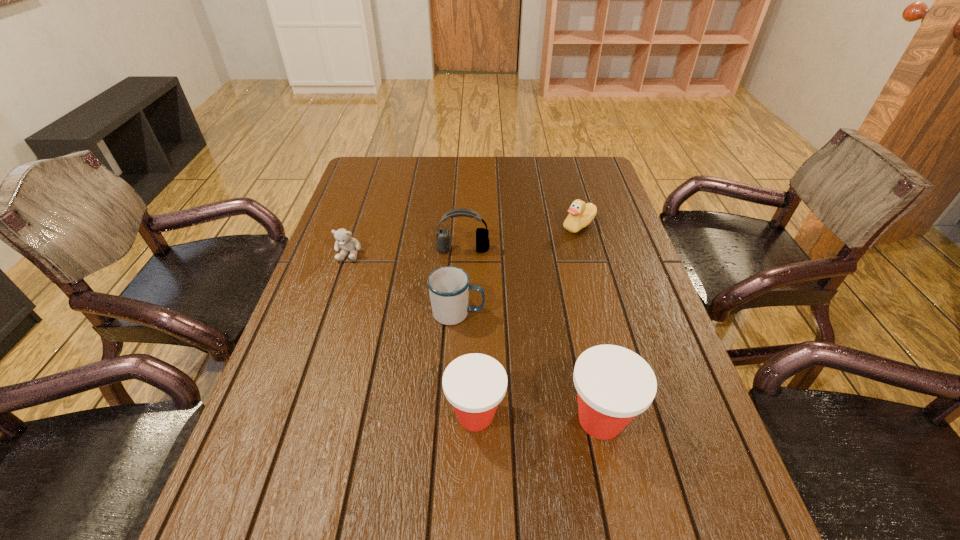
I want to click on vacant space at the near edge of the desktop, so click(477, 487).

The image size is (960, 540). Find the location of `free region at the left edge of the desktop`. free region at the left edge of the desktop is located at coordinates (386, 211).

At what (x,y) coordinates should I click in order to perform the action: click on vacant space at the right edge of the desktop. Please return your answer as a coordinate pair (x, y). This screenshot has width=960, height=540. Looking at the image, I should click on (637, 347).

This screenshot has width=960, height=540. Identify the location of vacant space at the far left corner. (392, 181).

Where is `free space at the near right corner of the desktop`? free space at the near right corner of the desktop is located at coordinates (637, 448).

At what (x,y) coordinates should I click in order to perform the action: click on unoccupied area between the shorter Dixie cup and the right Dixie cup. Please return your answer as a coordinate pair (x, y). This screenshot has width=960, height=540. Looking at the image, I should click on point(538,417).

This screenshot has width=960, height=540. Find the location of `unoccupied area between the third nearest object and the right Dixie cup`. unoccupied area between the third nearest object and the right Dixie cup is located at coordinates (529, 366).

Where is `blank region between the shorter Dixie cup and the headset`? The image size is (960, 540). blank region between the shorter Dixie cup and the headset is located at coordinates (469, 332).

In order to click on free space between the right Dixie cup and the fourth farthest object in this screenshot , I will do `click(529, 366)`.

Find the location of a particular element. The height and width of the screenshot is (540, 960). free space between the left Dixie cup and the leftmost object is located at coordinates (412, 334).